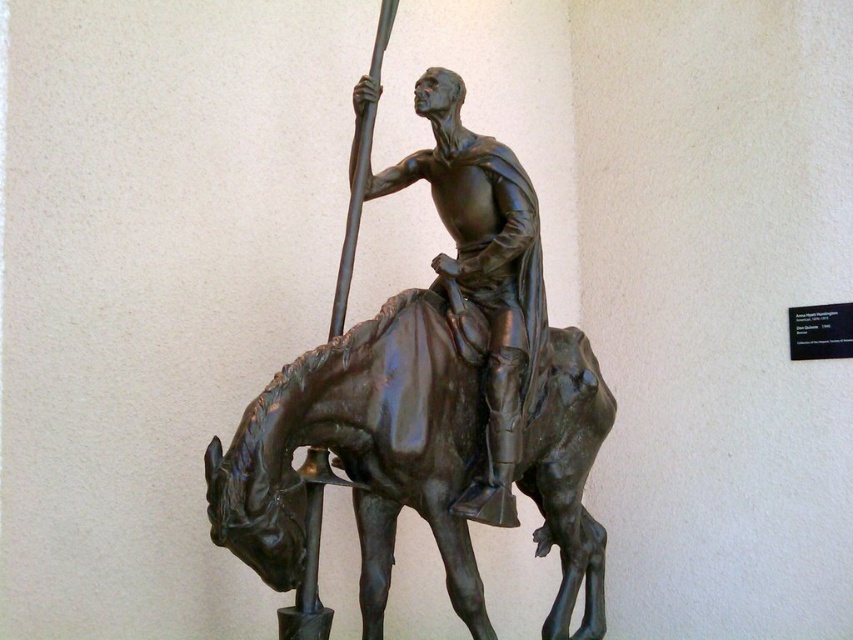
Who is higher up, shiny bronze horse at center or bronze statue at center?

Positioned higher is bronze statue at center.

Between shiny bronze horse at center and bronze statue at center, which one appears on the left side from the viewer's perspective?

shiny bronze horse at center is more to the left.

Is point (369, 470) positioned before point (506, 509)?

That is True.

Where is `shiny bronze horse at center`? This screenshot has width=853, height=640. shiny bronze horse at center is located at coordinates (361, 452).